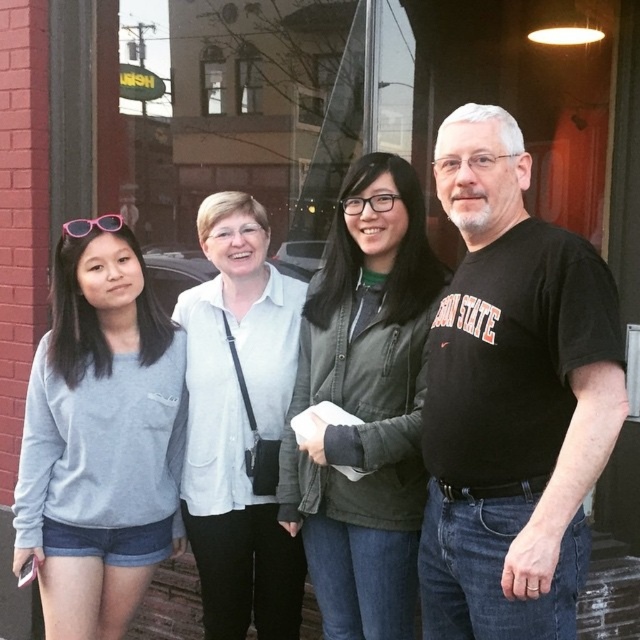
Question: Which of the following is the farthest from the observer?

Choices:
 (A) (120, 225)
 (B) (397, 266)
 (C) (269, 348)
 (D) (124, 234)

Answer: (C)

Question: Can you confirm if green matte jacket at center is bigger than white matte shirt at center?

Choices:
 (A) yes
 (B) no

Answer: (A)

Question: Does black cotton t-shirt at center appear under green matte jacket at center?

Choices:
 (A) yes
 (B) no

Answer: (B)

Question: Which point appears closest to the camera in this image?

Choices:
 (A) (550, 547)
 (B) (100, 228)
 (C) (120, 540)
 (D) (316, 445)

Answer: (A)

Question: Is green matte jacket at center behind white matte shirt at center?

Choices:
 (A) no
 (B) yes

Answer: (A)

Question: Which is nearer to the gray cotton sweatshirt at left?

Choices:
 (A) pink plastic sunglasses at upper left
 (B) green matte jacket at center

Answer: (A)